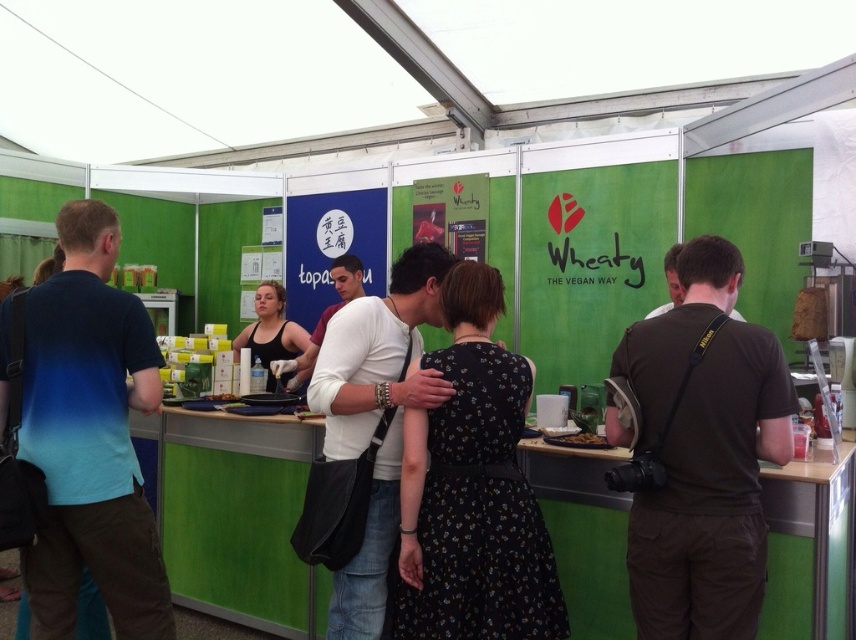
You are standing at the entrance of the tent and want to find the black floral dress at center. Which direction should you walk to reach it?

The black floral dress at center is located at point 0.767 on the x axis and 0.554 on the y axis. Since you are at the entrance, you should walk towards the center of the tent to reach the black floral dress at center.